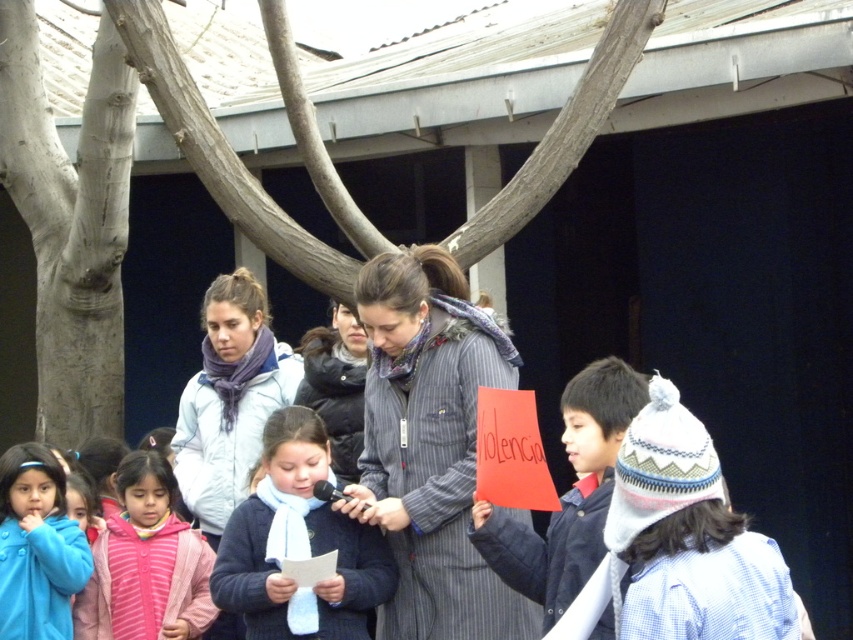
Between smooth white bark at center and blue fleece jacket at lower left, which one has less height?

blue fleece jacket at lower left

Based on the photo, is smooth white bark at center wider than blue fleece jacket at lower left?

Indeed, smooth white bark at center has a greater width compared to blue fleece jacket at lower left.

The image size is (853, 640). I want to click on smooth white bark at center, so click(x=71, y=224).

Can you confirm if white knitted hat at lower right is positioned to the right of dark blue sweater at center?

Correct, you'll find white knitted hat at lower right to the right of dark blue sweater at center.

Between point (694, 477) and point (323, 465), which one is positioned in front?

Point (694, 477) is more forward.

Identify the location of white knitted hat at lower right. tap(689, 538).

Describe the element at coordinates (430, 445) in the screenshot. I see `striped wool coat at center` at that location.

Between striped wool coat at center and matte red paper at center, which one is positioned lower?

Positioned lower is striped wool coat at center.

Find the location of a particular element. This screenshot has height=640, width=853. striped wool coat at center is located at coordinates (430, 445).

Where is `striped wool coat at center`? striped wool coat at center is located at coordinates (430, 445).